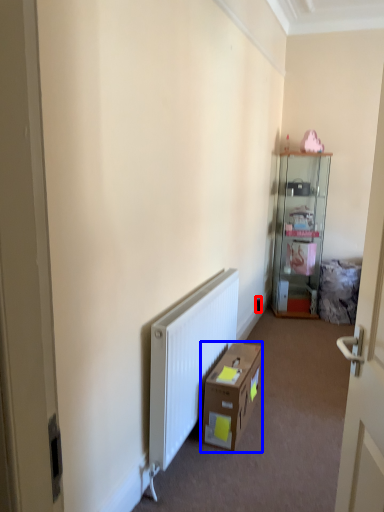
Question: Which object appears farthest to the camera in this image, electric outlet (highlighted by a red box) or cardboard box (highlighted by a blue box)?

Choices:
 (A) electric outlet
 (B) cardboard box

Answer: (A)